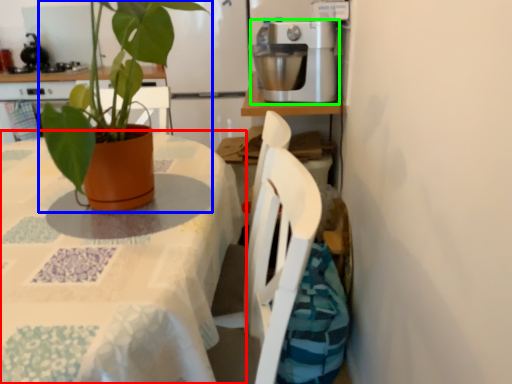
Question: Based on their relative distances, which object is nearer to table (highlighted by a red box)? Choose from houseplant (highlighted by a blue box) and kitchen appliance (highlighted by a green box).

Choices:
 (A) houseplant
 (B) kitchen appliance

Answer: (A)